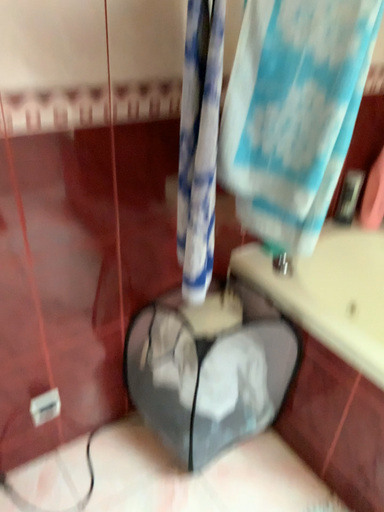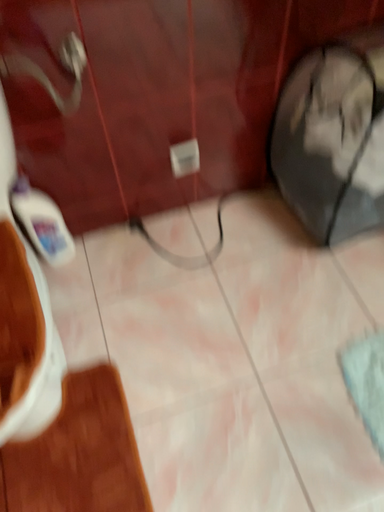
Question: Which way did the camera rotate in the video?

Choices:
 (A) rotated left
 (B) rotated right

Answer: (A)